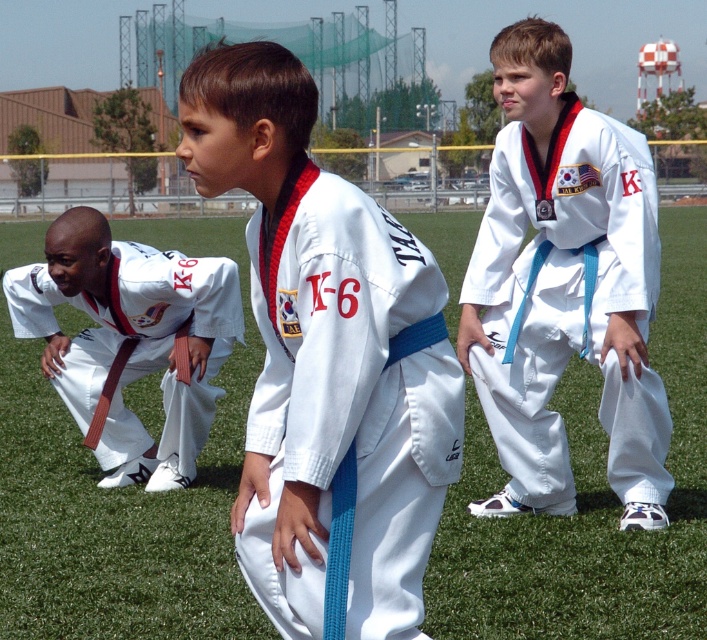
Question: Which object is closer to the camera taking this photo?

Choices:
 (A) white cotton karate uniform at center
 (B) green grass at center
 (C) blue fabric pants at center
 (D) brown belt karate uniform at lower left

Answer: (A)

Question: Where is blue fabric pants at center located in relation to brown belt karate uniform at lower left in the image?

Choices:
 (A) above
 (B) below

Answer: (A)

Question: Is green grass at center to the right of white cotton karate uniform at center from the viewer's perspective?

Choices:
 (A) no
 (B) yes

Answer: (B)

Question: Considering the relative positions of white cotton karate uniform at center and brown belt karate uniform at lower left in the image provided, where is white cotton karate uniform at center located with respect to brown belt karate uniform at lower left?

Choices:
 (A) below
 (B) above

Answer: (A)

Question: Which object is farther from the camera taking this photo?

Choices:
 (A) green grass at center
 (B) white cotton karate uniform at center
 (C) brown belt karate uniform at lower left

Answer: (C)

Question: Which point is closer to the camera?

Choices:
 (A) (81, 269)
 (B) (286, 445)
 (C) (501, 170)

Answer: (B)